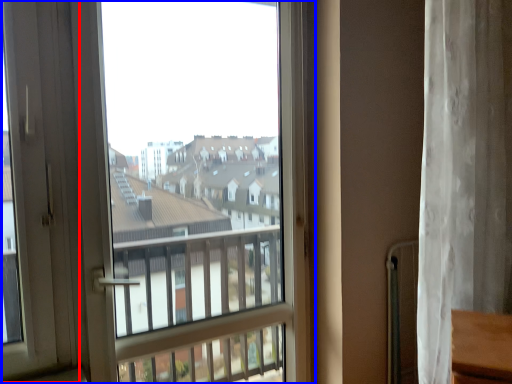
Question: Which of the following is the farthest to the observer, screen door (highlighted by a red box) or window (highlighted by a blue box)?

Choices:
 (A) screen door
 (B) window

Answer: (B)